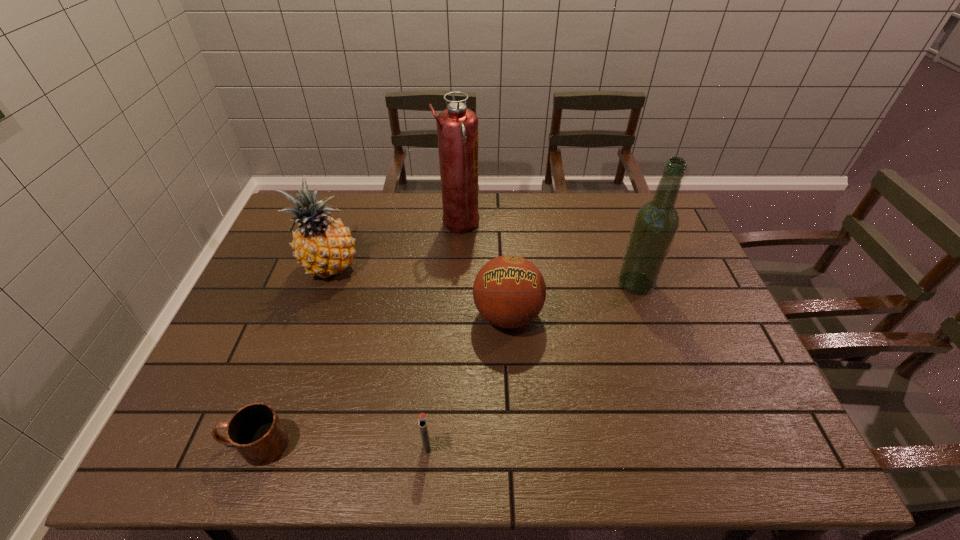
You are a GUI agent. You are given a task and a screenshot of the screen. Output one action in this format:
    pyautogui.click(x=<x>, y=<y>)
    Task: Click on the free space at the left edge of the desktop
    This screenshot has height=540, width=960.
    Given the screenshot: What is the action you would take?
    click(x=210, y=424)

What are the coordinates of `vacant space at the right edge of the desktop` in the screenshot? It's located at (707, 387).

Locate an element on the screen. The height and width of the screenshot is (540, 960). vacant space at the far right corner is located at coordinates (640, 194).

In order to click on blank region between the fourth tallest object and the pineapple in this screenshot , I will do `click(420, 291)`.

I want to click on vacant area that lies between the igniter and the pineapple, so click(379, 356).

Locate an element on the screen. free point between the igniter and the fire extinguisher is located at coordinates (443, 335).

Locate an element on the screen. unoccupied position between the mug and the igniter is located at coordinates (341, 445).

Where is `vacant point located between the pineapple and the fifth tallest object`? Image resolution: width=960 pixels, height=540 pixels. vacant point located between the pineapple and the fifth tallest object is located at coordinates (379, 356).

Where is `vacant area that lies between the mug and the basketball`? The image size is (960, 540). vacant area that lies between the mug and the basketball is located at coordinates (381, 380).

The width and height of the screenshot is (960, 540). In order to click on free space between the shortest object and the igniter in this screenshot , I will do `click(341, 445)`.